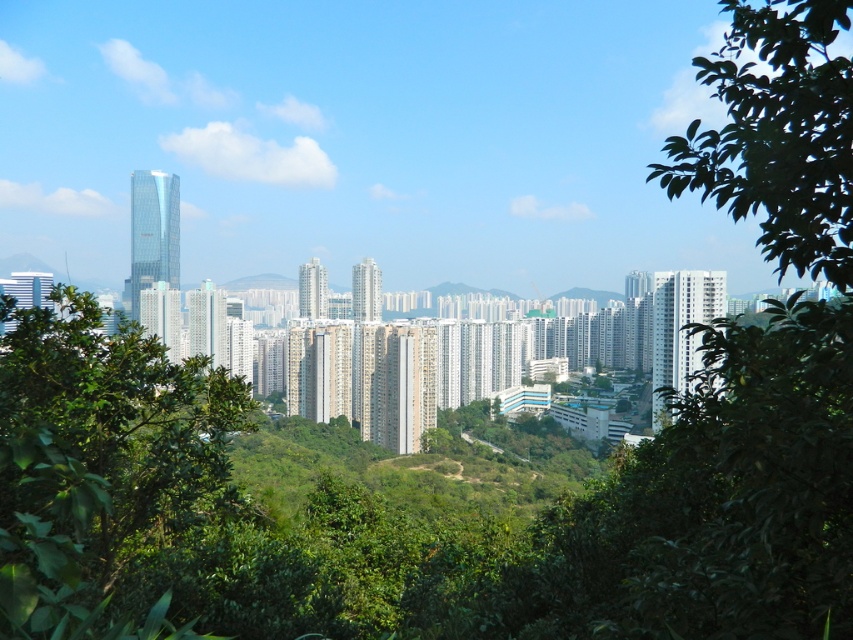
Which of these two, green leafy tree at left or green leafy tree at upper right, stands taller?

green leafy tree at left

Who is positioned more to the right, green leafy tree at left or green leafy tree at upper right?

Positioned to the right is green leafy tree at upper right.

Does point (210, 433) come in front of point (805, 99)?

No, it is not.

This screenshot has width=853, height=640. I want to click on green leafy tree at left, so click(x=99, y=464).